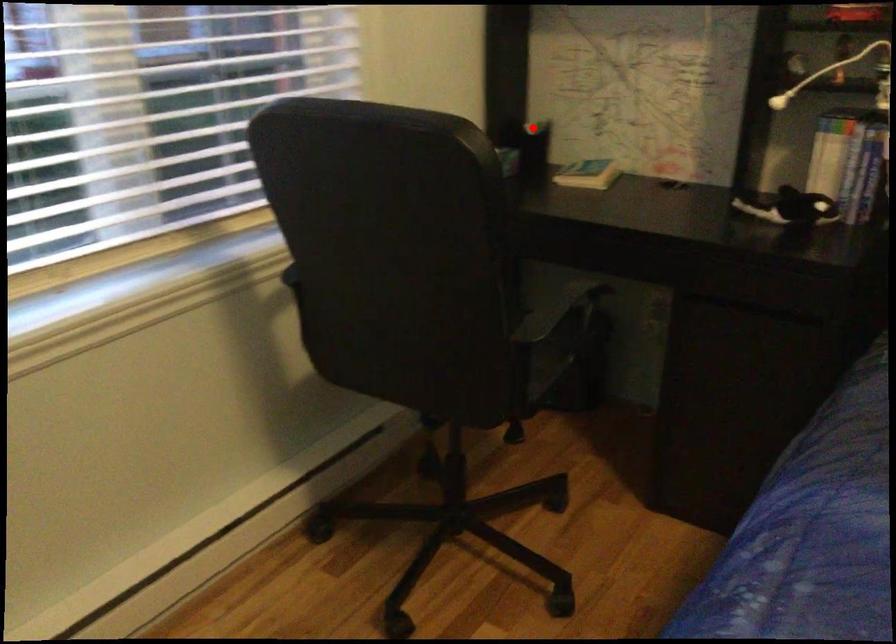
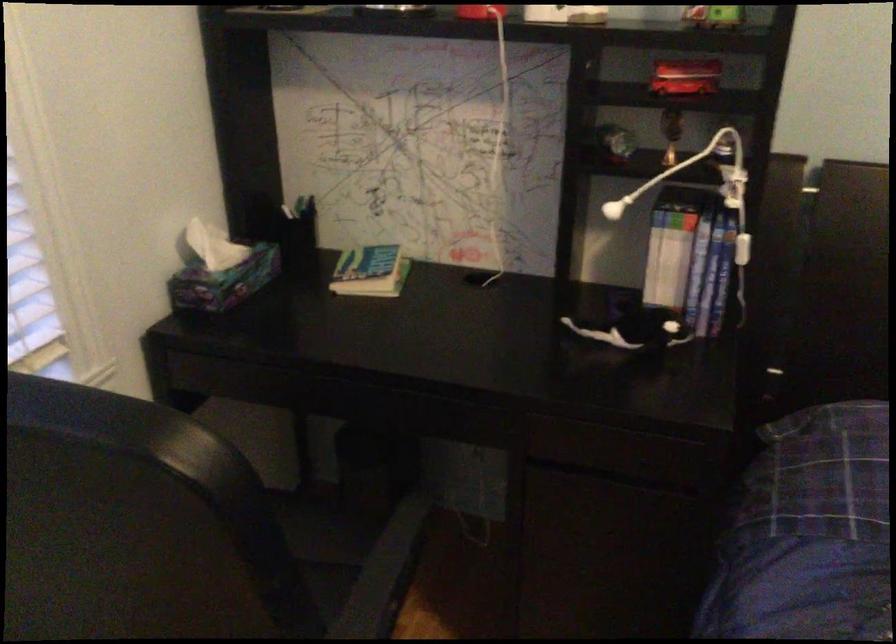
Question: I am providing you with two images of the same scene from different viewpoints. A red point is shown in image1. For the corresponding object point in image2, is it positioned nearer or farther from the camera?

Choices:
 (A) Nearer
 (B) Farther

Answer: (A)